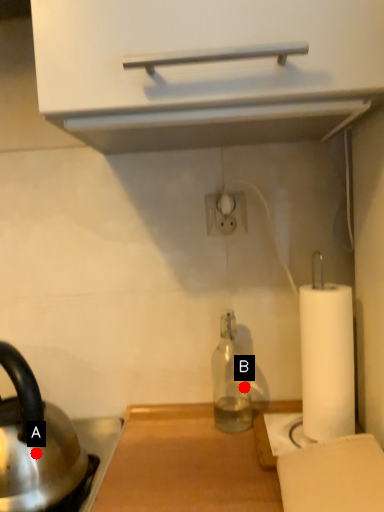
Question: Two points are circled on the image, labeled by A and B beside each circle. Which point is further to the camera?

Choices:
 (A) A is further
 (B) B is further

Answer: (B)